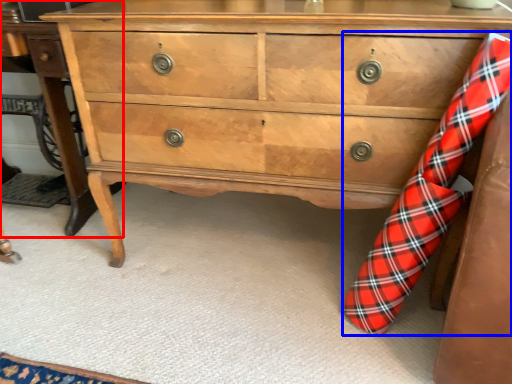
Question: Which point is closer to the camera, table (highlighted by a red box) or sock (highlighted by a blue box)?

Choices:
 (A) table
 (B) sock

Answer: (B)